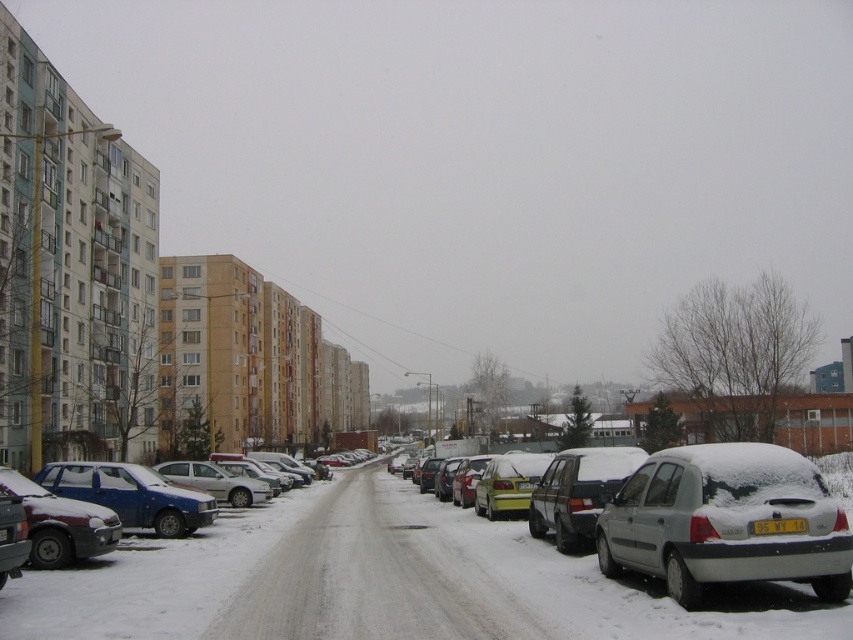
Question: Does blue matte sedan at lower left have a lesser width compared to white plastic license plate at center?

Choices:
 (A) yes
 (B) no

Answer: (B)

Question: Is matte blue sedan at lower left to the right of white plastic license plate at center from the viewer's perspective?

Choices:
 (A) yes
 (B) no

Answer: (B)

Question: Which object appears farthest from the camera in this image?

Choices:
 (A) sleek metallic hatchback at center-right
 (B) matte blue sedan at lower left
 (C) white plastic license plate at center
 (D) white matte car at lower right

Answer: (B)

Question: Is sleek metallic hatchback at center-right wider than white plastic license plate at center?

Choices:
 (A) no
 (B) yes

Answer: (B)

Question: Considering the real-world distances, which object is farthest from the matte silver sedan at lower left?

Choices:
 (A) sleek metallic hatchback at center-right
 (B) white plastic license plate at center

Answer: (B)

Question: Which object appears farthest from the camera in this image?

Choices:
 (A) white plastic license plate at center
 (B) matte silver sedan at lower left

Answer: (B)